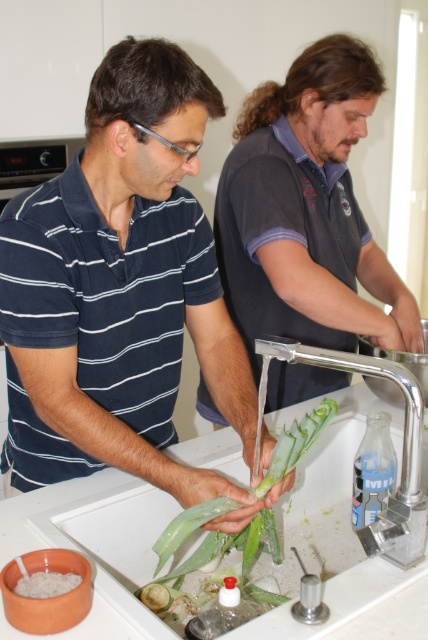
Looking at the kitchen scene, where is the blue striped shirt at left in relation to the green leafy vegetable at center?

The blue striped shirt at left is positioned to the left of the green leafy vegetable at center.

From the picture: You are a chef preparing a dish and need to rinse the green leafy vegetable at center. Where should you place it to get water from the chrome metallic faucet at upper right?

The chrome metallic faucet at upper right is located above the green leafy vegetable at center, so placing the vegetable directly under the faucet will allow water to flow over it effectively.

You are standing in the kitchen and want to pick up an item from the counter. There are two points on the counter marked as point 1 at coordinates point (400, 384) and point 2 at coordinates point (219, 504). Which point is closer to you?

Point (400, 384) is closer to the viewer than point (219, 504), so you should reach for that one first.